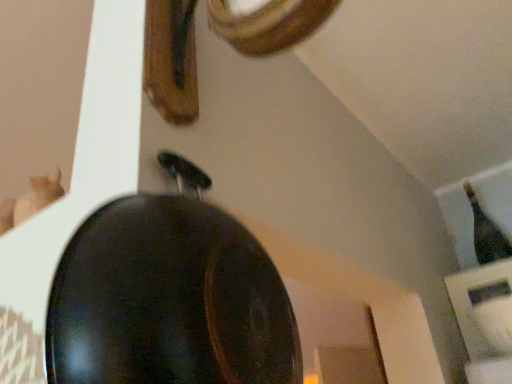
Image resolution: width=512 pixels, height=384 pixels. I want to click on green glass bottle at upper right, so click(x=486, y=233).

What is the approximate height of green glass bottle at upper right?

green glass bottle at upper right is 14.43 inches in height.

What do you see at coordinates (486, 233) in the screenshot? This screenshot has height=384, width=512. I see `green glass bottle at upper right` at bounding box center [486, 233].

Identify the location of shiny black frying pan at center. The width and height of the screenshot is (512, 384). (169, 296).

What do you see at coordinates (169, 296) in the screenshot? The height and width of the screenshot is (384, 512). I see `shiny black frying pan at center` at bounding box center [169, 296].

What is the approximate height of shiny black frying pan at center?

The height of shiny black frying pan at center is 11.23 inches.

Locate an element on the screen. This screenshot has height=384, width=512. green glass bottle at upper right is located at coordinates (486, 233).

Is green glass bottle at upper right at the right side of shiny black frying pan at center?

Indeed, green glass bottle at upper right is positioned on the right side of shiny black frying pan at center.

In the scene shown: Which object is further away from the camera, green glass bottle at upper right or shiny black frying pan at center?

green glass bottle at upper right is behind.

Does point (487, 215) lie in front of point (105, 226)?

No.

From the image's perspective, between green glass bottle at upper right and shiny black frying pan at center, which one is located above?

From the image's view, shiny black frying pan at center is above.

From a real-world perspective, is green glass bottle at upper right above or below shiny black frying pan at center?

Clearly, from a real-world perspective, green glass bottle at upper right is above shiny black frying pan at center.

Which object is wider, green glass bottle at upper right or shiny black frying pan at center?

green glass bottle at upper right.

Is green glass bottle at upper right shorter than shiny black frying pan at center?

Incorrect, the height of green glass bottle at upper right does not fall short of that of shiny black frying pan at center.

Considering the sizes of green glass bottle at upper right and shiny black frying pan at center in the image, is green glass bottle at upper right bigger or smaller than shiny black frying pan at center?

green glass bottle at upper right is smaller than shiny black frying pan at center.

Is green glass bottle at upper right completely or partially outside of shiny black frying pan at center?

That's correct, green glass bottle at upper right is outside of shiny black frying pan at center.

Is green glass bottle at upper right directly adjacent to shiny black frying pan at center?

green glass bottle at upper right and shiny black frying pan at center are clearly separated.

Does green glass bottle at upper right turn towards shiny black frying pan at center?

Yes, green glass bottle at upper right is facing shiny black frying pan at center.

Identify the location of frying pan lying in front of the green glass bottle at upper right. The height and width of the screenshot is (384, 512). (169, 296).

Considering the relative positions of shiny black frying pan at center and green glass bottle at upper right in the image provided, is shiny black frying pan at center to the left of green glass bottle at upper right from the viewer's perspective?

Indeed, shiny black frying pan at center is positioned on the left side of green glass bottle at upper right.

Is the depth of shiny black frying pan at center greater than that of green glass bottle at upper right?

No, shiny black frying pan at center is closer to the camera.

Which is closer, (x=147, y=334) or (x=479, y=234)?

Positioned in front is point (x=147, y=334).

From the image's perspective, is shiny black frying pan at center on top of green glass bottle at upper right?

Indeed, from the image's perspective, shiny black frying pan at center is shown above green glass bottle at upper right.

Based on the photo, from a real-world perspective, is shiny black frying pan at center above or below green glass bottle at upper right?

Clearly, from a real-world perspective, shiny black frying pan at center is below green glass bottle at upper right.

Considering the sizes of shiny black frying pan at center and green glass bottle at upper right in the image, is shiny black frying pan at center wider or thinner than green glass bottle at upper right?

Clearly, shiny black frying pan at center has less width compared to green glass bottle at upper right.

Considering the sizes of shiny black frying pan at center and green glass bottle at upper right in the image, is shiny black frying pan at center taller or shorter than green glass bottle at upper right?

shiny black frying pan at center is shorter than green glass bottle at upper right.

Who is smaller, shiny black frying pan at center or green glass bottle at upper right?

With smaller size is green glass bottle at upper right.

Is shiny black frying pan at center positioned beyond the bounds of green glass bottle at upper right?

Yes, shiny black frying pan at center is located beyond the bounds of green glass bottle at upper right.

Is there a large distance between shiny black frying pan at center and green glass bottle at upper right?

Yes, shiny black frying pan at center is far from green glass bottle at upper right.

Is shiny black frying pan at center looking in the opposite direction of green glass bottle at upper right?

No, green glass bottle at upper right is not at the back of shiny black frying pan at center.

Can you tell me how much shiny black frying pan at center and green glass bottle at upper right differ in facing direction?

The facing directions of shiny black frying pan at center and green glass bottle at upper right are 88.9 degrees apart.

Where is `bottle above the shiny black frying pan at center (from a real-world perspective)`? This screenshot has width=512, height=384. bottle above the shiny black frying pan at center (from a real-world perspective) is located at coordinates (486, 233).

This screenshot has height=384, width=512. I want to click on bottle located behind the shiny black frying pan at center, so click(486, 233).

You are a GUI agent. You are given a task and a screenshot of the screen. Output one action in this format:
    pyautogui.click(x=<x>, y=<y>)
    Task: Click on the frying pan lying above the green glass bottle at upper right (from the image's perspective)
    This screenshot has width=512, height=384.
    Given the screenshot: What is the action you would take?
    pyautogui.click(x=169, y=296)